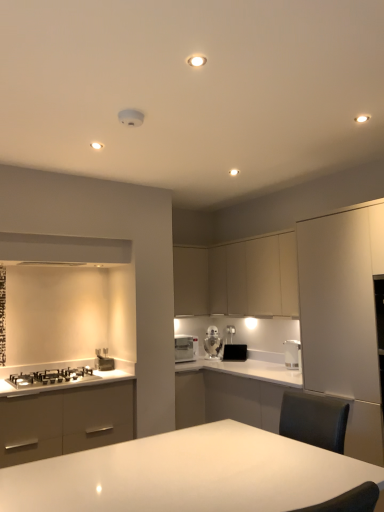
Question: Does white glossy countertop at lower left have a greater height compared to matte beige cabinet at center, the 3th cabinetry positioned from the front?

Choices:
 (A) yes
 (B) no

Answer: (B)

Question: Is white glossy countertop at lower left located outside matte beige cabinet at center, the 3th cabinetry positioned from the front?

Choices:
 (A) no
 (B) yes

Answer: (B)

Question: Does white glossy countertop at lower left have a lesser width compared to matte beige cabinet at center, the 3th cabinetry positioned from the front?

Choices:
 (A) yes
 (B) no

Answer: (B)

Question: Can you confirm if white glossy countertop at lower left is smaller than matte beige cabinet at center, placed as the 1th cabinetry when sorted from back to front?

Choices:
 (A) no
 (B) yes

Answer: (B)

Question: Considering the relative positions of white glossy countertop at lower left and matte beige cabinet at center, the 3th cabinetry positioned from the front, in the image provided, is white glossy countertop at lower left in front of matte beige cabinet at center, the 3th cabinetry positioned from the front,?

Choices:
 (A) yes
 (B) no

Answer: (A)

Question: Considering their positions, is satin silver kettle at right, placed as the first kitchen appliance when sorted from right to left, located in front of or behind black matte toaster at center, positioned as the first appliance in right-to-left order?

Choices:
 (A) behind
 (B) front

Answer: (B)

Question: Is satin silver kettle at right, the 1th kitchen appliance from the front, wider or thinner than black matte toaster at center, positioned as the first appliance in right-to-left order?

Choices:
 (A) wide
 (B) thin

Answer: (B)

Question: Is satin silver kettle at right, the 1th kitchen appliance from the front, taller or shorter than black matte toaster at center, marked as the second appliance in a left-to-right arrangement?

Choices:
 (A) short
 (B) tall

Answer: (B)

Question: From the image's perspective, relative to black matte toaster at center, marked as the second appliance in a left-to-right arrangement, is satin silver kettle at right, which is the 3th kitchen appliance from left to right, above or below?

Choices:
 (A) above
 (B) below

Answer: (A)

Question: Would you say white glossy table at center is to the left or to the right of white glossy toaster at center, marked as the first kitchen appliance in a back-to-front arrangement, in the picture?

Choices:
 (A) right
 (B) left

Answer: (B)

Question: Is point (200, 499) positioned closer to the camera than point (215, 350)?

Choices:
 (A) farther
 (B) closer

Answer: (B)

Question: From the image's perspective, is white glossy table at center located above or below white glossy toaster at center, marked as the first kitchen appliance in a back-to-front arrangement?

Choices:
 (A) below
 (B) above

Answer: (A)

Question: Looking at the image, does white glossy table at center seem bigger or smaller compared to white glossy toaster at center, marked as the first kitchen appliance in a back-to-front arrangement?

Choices:
 (A) big
 (B) small

Answer: (A)

Question: Is white glossy microwave at center, which ranks as the 3th kitchen appliance in right-to-left order, in front of or behind satin silver toaster at lower left, positioned as the 1th appliance in left-to-right order, in the image?

Choices:
 (A) front
 (B) behind

Answer: (B)

Question: Visually, is white glossy microwave at center, which ranks as the 3th kitchen appliance in right-to-left order, positioned to the left or to the right of satin silver toaster at lower left, which is the second appliance in back-to-front order?

Choices:
 (A) right
 (B) left

Answer: (A)